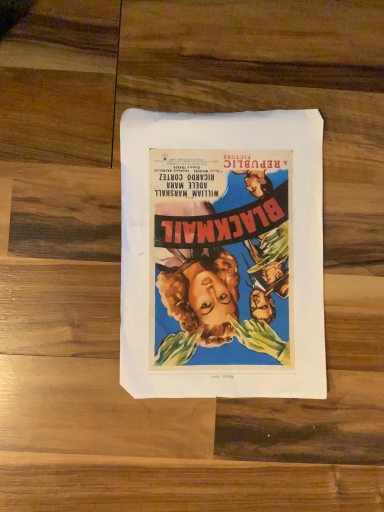
This screenshot has height=512, width=384. What do you see at coordinates (222, 255) in the screenshot? I see `vibrant paper poster at center` at bounding box center [222, 255].

Measure the distance between point (232,346) and camera.

43.20 centimeters.

Where is `vibrant paper poster at center`? This screenshot has height=512, width=384. vibrant paper poster at center is located at coordinates (222, 255).

The width and height of the screenshot is (384, 512). In order to click on vibrant paper poster at center in this screenshot , I will do (x=222, y=255).